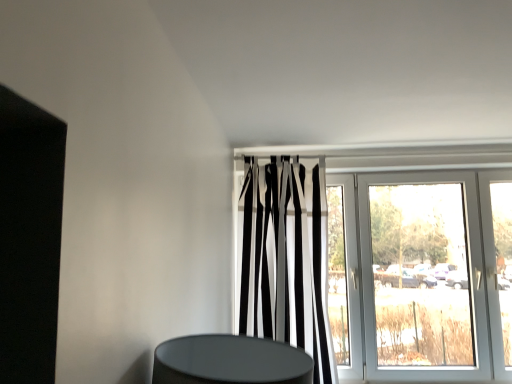
Measure the distance between point (511, 177) and camera.

A distance of 9.48 feet exists between point (511, 177) and camera.

Find the location of `white glossy door at upper center`. white glossy door at upper center is located at coordinates (422, 277).

Describe the element at coordinates (422, 277) in the screenshot. The width and height of the screenshot is (512, 384). I see `white glossy door at upper center` at that location.

What is the approximate width of black and white striped curtain at center?

black and white striped curtain at center is 11.22 inches wide.

What do you see at coordinates (287, 259) in the screenshot? The image size is (512, 384). I see `black and white striped curtain at center` at bounding box center [287, 259].

Find the location of a particular element. black and white striped curtain at center is located at coordinates (287, 259).

This screenshot has width=512, height=384. Identify the location of white glossy door at upper center. (422, 277).

Based on the photo, can you confirm if black and white striped curtain at center is positioned to the right of white glossy door at upper center?

Incorrect, black and white striped curtain at center is not on the right side of white glossy door at upper center.

Does black and white striped curtain at center lie behind white glossy door at upper center?

No, black and white striped curtain at center is closer to the viewer.

Considering the positions of points (242, 323) and (455, 270), is point (242, 323) closer to camera compared to point (455, 270)?

Yes, point (242, 323) is closer to viewer.

Looking at this image, from the image's perspective, between black and white striped curtain at center and white glossy door at upper center, which one is located above?

black and white striped curtain at center.

From a real-world perspective, which object stands above the other?

From a 3D spatial view, black and white striped curtain at center is above.

Does black and white striped curtain at center have a greater width compared to white glossy door at upper center?

Yes.

Can you confirm if black and white striped curtain at center is shorter than white glossy door at upper center?

Incorrect, the height of black and white striped curtain at center does not fall short of that of white glossy door at upper center.

Who is smaller, black and white striped curtain at center or white glossy door at upper center?

black and white striped curtain at center is smaller.

Which is correct: black and white striped curtain at center is inside white glossy door at upper center, or outside of it?

black and white striped curtain at center exists outside the volume of white glossy door at upper center.

Is there a large distance between black and white striped curtain at center and white glossy door at upper center?

No, black and white striped curtain at center is not far from white glossy door at upper center.

Is black and white striped curtain at center oriented away from white glossy door at upper center?

Correct, black and white striped curtain at center is looking away from white glossy door at upper center.

What's the angular difference between black and white striped curtain at center and white glossy door at upper center's facing directions?

The angle between the facing direction of black and white striped curtain at center and the facing direction of white glossy door at upper center is 0.000113 degrees.

This screenshot has height=384, width=512. What are the coordinates of `door on the right of black and white striped curtain at center` in the screenshot? It's located at (422, 277).

Which is more to the left, white glossy door at upper center or black and white striped curtain at center?

Positioned to the left is black and white striped curtain at center.

Does white glossy door at upper center lie behind black and white striped curtain at center?

Yes, it is behind black and white striped curtain at center.

Looking at this image, which is closer to the camera, (386, 255) or (292, 187)?

The point (292, 187) is closer to the camera.

From the image's perspective, is white glossy door at upper center under black and white striped curtain at center?

Yes, from the image's perspective, white glossy door at upper center is beneath black and white striped curtain at center.

From a real-world perspective, is white glossy door at upper center physically below black and white striped curtain at center?

Yes, from a real-world perspective, white glossy door at upper center is beneath black and white striped curtain at center.

Considering the sizes of objects white glossy door at upper center and black and white striped curtain at center in the image provided, who is wider, white glossy door at upper center or black and white striped curtain at center?

With larger width is black and white striped curtain at center.

From their relative heights in the image, would you say white glossy door at upper center is taller or shorter than black and white striped curtain at center?

white glossy door at upper center is shorter than black and white striped curtain at center.

Considering the sizes of white glossy door at upper center and black and white striped curtain at center in the image, is white glossy door at upper center bigger or smaller than black and white striped curtain at center?

white glossy door at upper center is bigger than black and white striped curtain at center.

Can black and white striped curtain at center be found inside white glossy door at upper center?

Actually, black and white striped curtain at center is outside white glossy door at upper center.

Is white glossy door at upper center placed right next to black and white striped curtain at center?

They are not placed beside each other.

Is white glossy door at upper center facing away from black and white striped curtain at center?

Yes, white glossy door at upper center's orientation is away from black and white striped curtain at center.

Can you tell me how much white glossy door at upper center and black and white striped curtain at center differ in facing direction?

There is a 0.000113-degree angle between the facing directions of white glossy door at upper center and black and white striped curtain at center.

You are a GUI agent. You are given a task and a screenshot of the screen. Output one action in this format:
    pyautogui.click(x=<x>, y=<y>)
    Task: Click on the door located below the black and white striped curtain at center (from the image's perspective)
    The width and height of the screenshot is (512, 384).
    Given the screenshot: What is the action you would take?
    (422, 277)

Where is `curtain that is in front of the white glossy door at upper center`? curtain that is in front of the white glossy door at upper center is located at coordinates (287, 259).

You are a GUI agent. You are given a task and a screenshot of the screen. Output one action in this format:
    pyautogui.click(x=<x>, y=<y>)
    Task: Click on the door below the black and white striped curtain at center (from a real-world perspective)
    This screenshot has height=384, width=512.
    Given the screenshot: What is the action you would take?
    pyautogui.click(x=422, y=277)